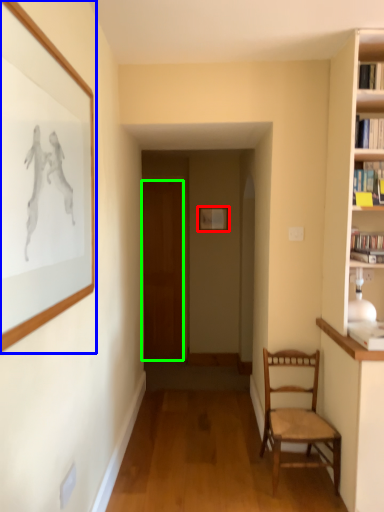
Question: Based on their relative distances, which object is nearer to picture frame (highlighted by a red box)? Choose from picture frame (highlighted by a blue box) and door (highlighted by a green box).

Choices:
 (A) picture frame
 (B) door

Answer: (B)